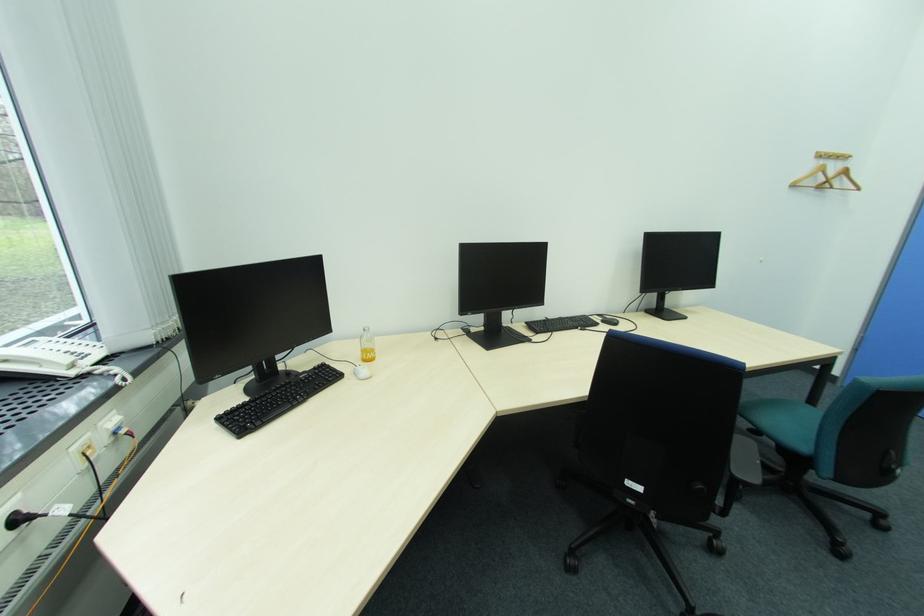
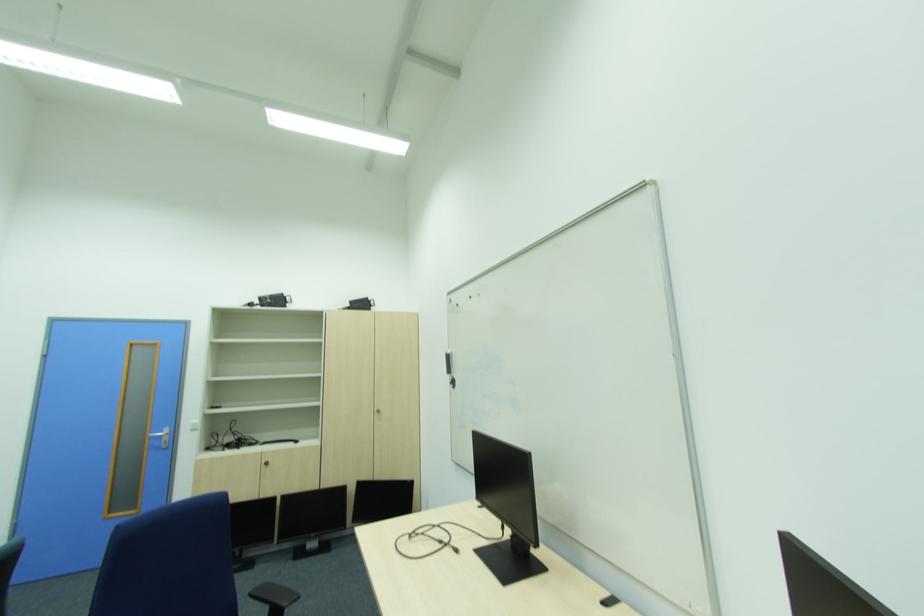
Question: How did the camera likely rotate?

Choices:
 (A) Left
 (B) Right
 (C) Up
 (D) Down

Answer: (B)